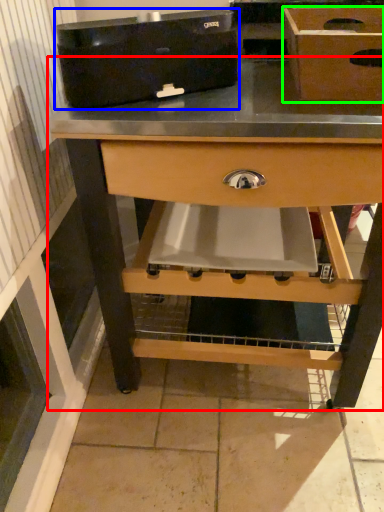
Question: Considering the real-world distances, which object is farthest from table (highlighted by a red box)? appliance (highlighted by a blue box) or box (highlighted by a green box)?

Choices:
 (A) appliance
 (B) box

Answer: (B)